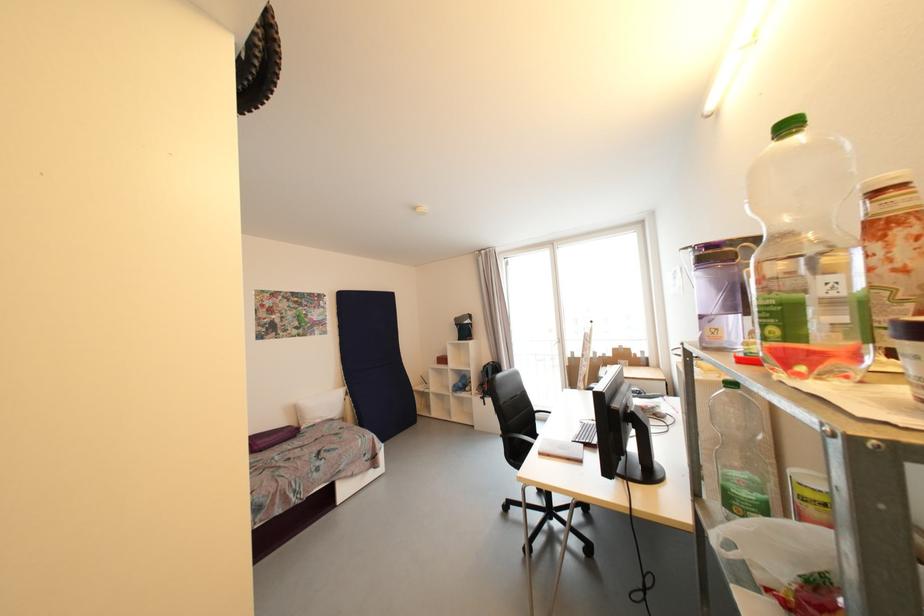
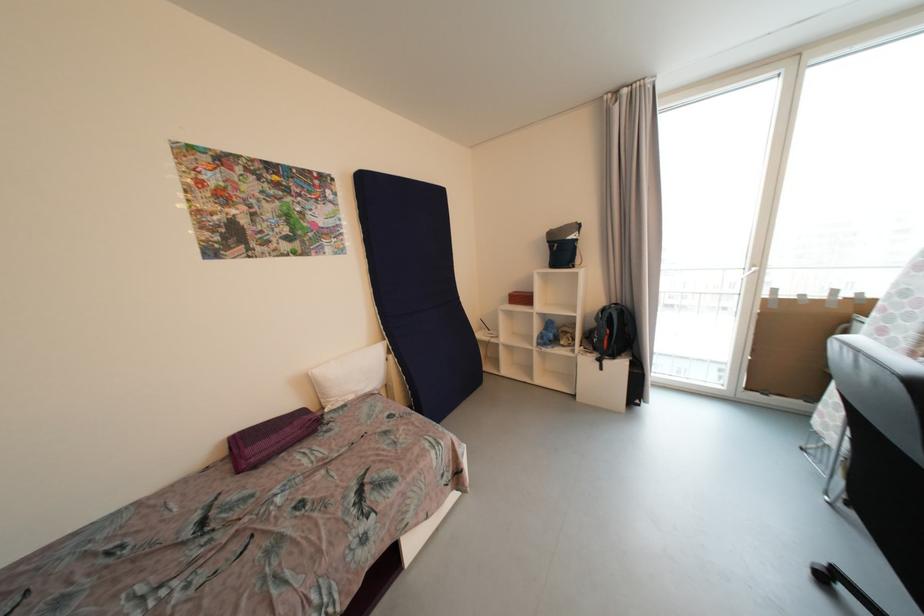
In the second image, find the point that corresponds to the point at 353,399 in the first image.

(396, 359)